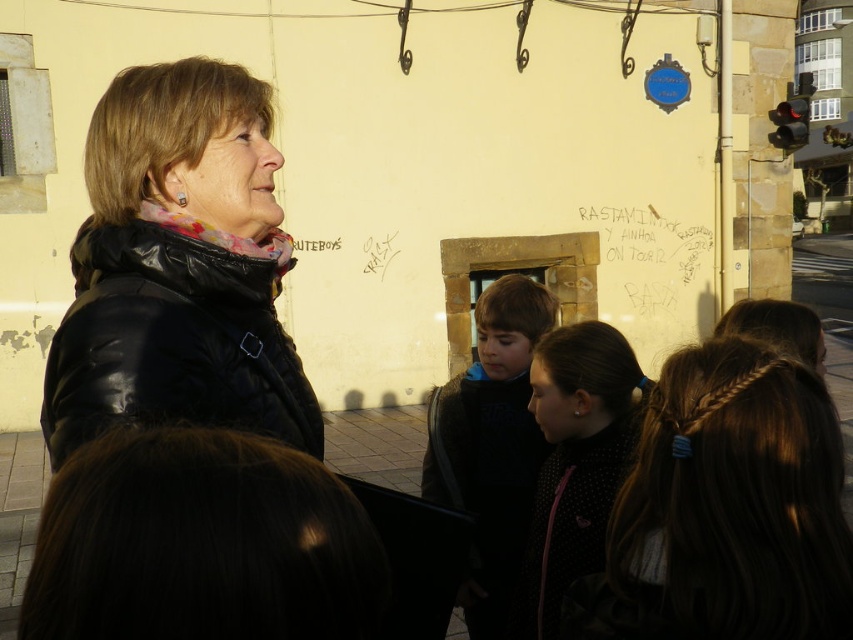
You are a photographer trying to capture a clear shot of the woman in the scene. You notice two strands of hair on her face. The dark brown hair at lower left and the brown hair at center. Which strand of hair is closer to the camera?

The dark brown hair at lower left is shorter than the brown hair at center, so the brown hair at center is closer to the camera.

You are standing at the center of the scene and want to find the black leather jacket at upper left. Which direction should you look to locate it?

You should look to the upper left direction to find the black leather jacket at upper left as it is located at point (178, 266).

You are a photographer trying to capture a portrait of the woman. The camera is focused on the brown hair at center. Since the dark blue sweater at center is in the background, will it be in focus or blurry?

The brown hair at center is above the dark blue sweater at center, so the sweater is further away from the camera. Since the camera is focused on the hair, the dark blue sweater at center will appear blurry in the photo.